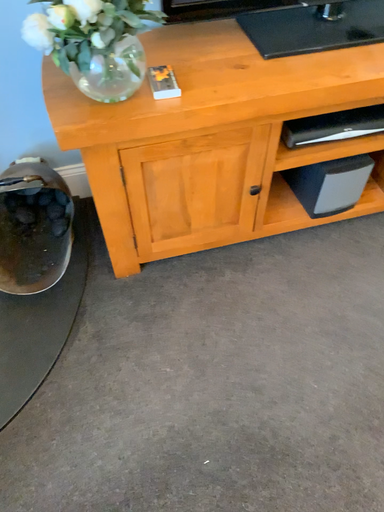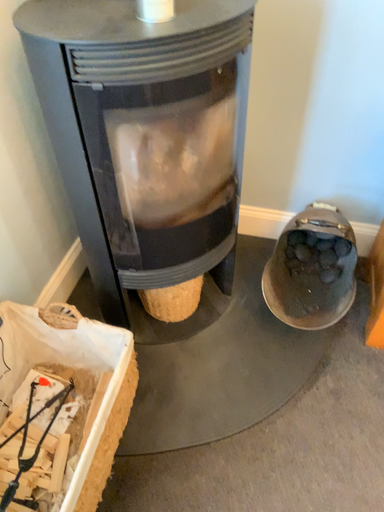
Question: Which way did the camera rotate in the video?

Choices:
 (A) rotated right
 (B) rotated left

Answer: (B)